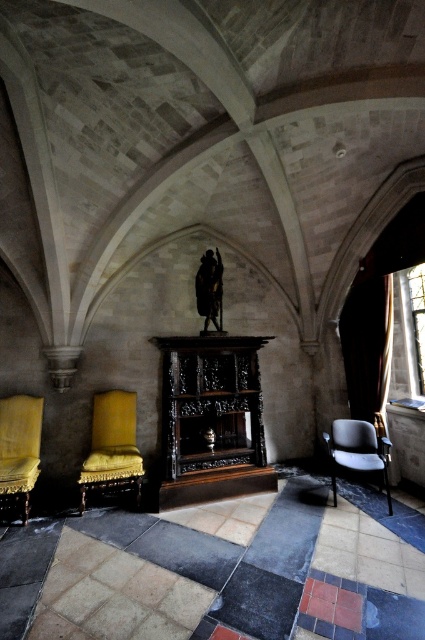
Which of these two, velvet yellow armchair at left or matte black armchair at lower right, stands taller?

velvet yellow armchair at left

Is point (102, 452) farther from viewer compared to point (342, 428)?

No, it is in front of (342, 428).

Is point (121, 454) behind point (337, 428)?

No, it is in front of (337, 428).

In order to click on velvet yellow armchair at left in this screenshot , I will do [x=113, y=445].

Can you confirm if velvet yellow armchair at left is positioned above gold fabric armchair at left?

Yes.

Is point (119, 420) positioned before point (17, 426)?

No.

Which is in front, point (82, 486) or point (34, 426)?

Positioned in front is point (82, 486).

Find the location of a particular element. velvet yellow armchair at left is located at coordinates (113, 445).

Measure the distance between gold fabric armchair at left and camera.

3.90 meters

Which is more to the right, gold fabric armchair at left or matte black armchair at lower right?

Positioned to the right is matte black armchair at lower right.

Between point (31, 429) and point (348, 452), which one is positioned behind?

The point (31, 429) is more distant.

The height and width of the screenshot is (640, 425). I want to click on gold fabric armchair at left, so click(x=19, y=449).